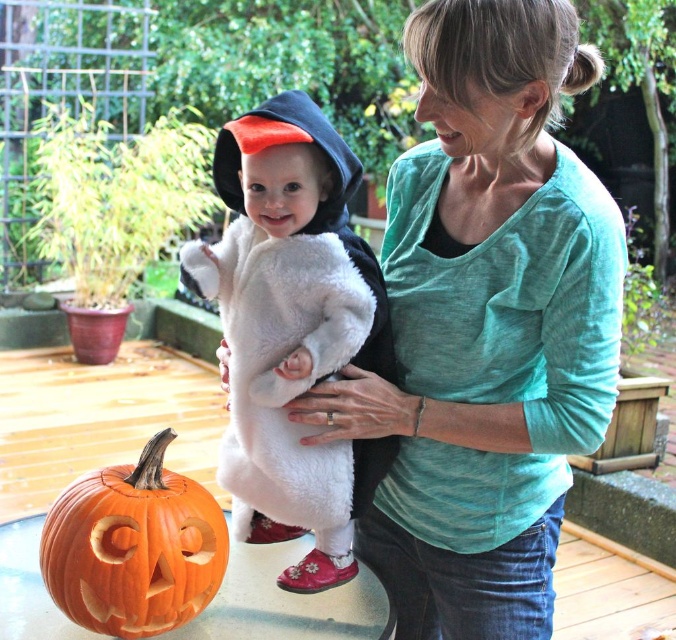
Question: Does fluffy white costume at center appear on the left side of orange carved pumpkin at lower left?

Choices:
 (A) no
 (B) yes

Answer: (A)

Question: Which point is farther to the camera?

Choices:
 (A) teal soft shirt at center
 (B) orange carved pumpkin at lower left

Answer: (B)

Question: Among these objects, which one is nearest to the camera?

Choices:
 (A) teal soft shirt at center
 (B) orange carved pumpkin at lower left
 (C) fluffy white costume at center

Answer: (A)

Question: Is teal soft shirt at center bigger than fluffy white costume at center?

Choices:
 (A) no
 (B) yes

Answer: (B)

Question: Among these points, which one is nearest to the camera?

Choices:
 (A) (354, 292)
 (B) (507, 522)
 (C) (132, 529)

Answer: (C)

Question: Does teal soft shirt at center appear on the right side of orange carved pumpkin at lower left?

Choices:
 (A) no
 (B) yes

Answer: (B)